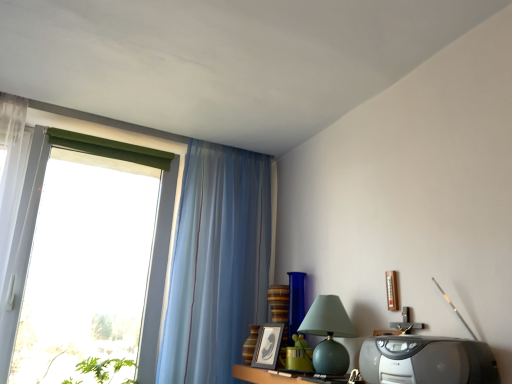
The image size is (512, 384). I want to click on translucent blue curtain at left, so click(x=217, y=263).

Locate an element on the screen. blue glass vase at center, the 2th glass vase when ordered from left to right is located at coordinates (296, 302).

Describe the element at coordinates (279, 308) in the screenshot. I see `striped ceramic vase at center` at that location.

Measure the distance between striped ceramic vase at center and camera.

striped ceramic vase at center is 1.86 meters from camera.

Describe the element at coordinates (39, 199) in the screenshot. I see `transparent glass window at left` at that location.

The height and width of the screenshot is (384, 512). Find the location of `wooden table at lower center`. wooden table at lower center is located at coordinates (262, 376).

Where is `black matte picture frame at center`? Image resolution: width=512 pixels, height=384 pixels. black matte picture frame at center is located at coordinates (268, 346).

Between point (227, 263) and point (302, 301), which one is positioned behind?

The point (227, 263) is more distant.

Could you measure the distance between translucent blue curtain at left and blue glass vase at center, the 2th glass vase when ordered from left to right?

They are 16.41 inches apart.

From the picture: Does translucent blue curtain at left lie in front of blue glass vase at center, acting as the first glass vase starting from the right?

Yes, it is.

Which of these two, translucent blue curtain at left or blue glass vase at center, acting as the first glass vase starting from the right, stands taller?

Result: translucent blue curtain at left.

From the transparent glass window at left, count 2nd glass vase to the right and point to it. Please provide its 2D coordinates.

[(296, 302)]

Could blue glass vase at center, the 2th glass vase when ordered from left to right, be considered to be inside transparent glass window at left?

No, transparent glass window at left does not contain blue glass vase at center, the 2th glass vase when ordered from left to right.

In the scene shown: Based on their positions, is transparent glass window at left located to the left or right of blue glass vase at center, the 2th glass vase when ordered from left to right?

In the image, transparent glass window at left appears on the left side of blue glass vase at center, the 2th glass vase when ordered from left to right.

Is transparent glass window at left positioned with its back to blue glass vase at center, acting as the first glass vase starting from the right?

No, transparent glass window at left's orientation is not away from blue glass vase at center, acting as the first glass vase starting from the right.

How many degrees apart are the facing directions of striped ceramic vase at center and black matte picture frame at center?

They differ by 27 degrees in their facing directions.

Is striped ceramic vase at center looking in the opposite direction of black matte picture frame at center?

No.

Considering the positions of points (281, 346) and (254, 358), is point (281, 346) closer to camera compared to point (254, 358)?

No.

Who is taller, striped ceramic vase at center or black matte picture frame at center?

Standing taller between the two is striped ceramic vase at center.

From a real-world perspective, which is physically above, black matte picture frame at center or blue glass vase at center, the 2th glass vase when ordered from left to right?

In real-world perspective, blue glass vase at center, the 2th glass vase when ordered from left to right, is above.

Is black matte picture frame at center at the left side of blue glass vase at center, acting as the first glass vase starting from the right?

Yes, black matte picture frame at center is to the left of blue glass vase at center, acting as the first glass vase starting from the right.

Is black matte picture frame at center bigger than blue glass vase at center, the 2th glass vase when ordered from left to right?

Actually, black matte picture frame at center might be smaller than blue glass vase at center, the 2th glass vase when ordered from left to right.

Which of these two, translucent blue curtain at left or striped ceramic vase at center, is smaller?

striped ceramic vase at center is smaller.

In terms of height, does translucent blue curtain at left look taller or shorter compared to striped ceramic vase at center?

translucent blue curtain at left is taller than striped ceramic vase at center.

Is translucent blue curtain at left placed right next to striped ceramic vase at center?

They are not placed beside each other.

Is transparent glass window at left not near striped glass vase at center, acting as the 2th glass vase starting from the right?

Actually, transparent glass window at left and striped glass vase at center, acting as the 2th glass vase starting from the right, are a little close together.

From a real-world perspective, is transparent glass window at left on top of striped glass vase at center, the first glass vase from the left?

Correct, in the physical world, transparent glass window at left is higher than striped glass vase at center, the first glass vase from the left.

Is transparent glass window at left aimed at striped glass vase at center, the first glass vase from the left?

Yes.

Would you say transparent glass window at left contains striped glass vase at center, the first glass vase from the left?

No, transparent glass window at left does not contain striped glass vase at center, the first glass vase from the left.

From a real-world perspective, between striped ceramic vase at center and matte green glass table lamp at center-right, who is vertically lower?

matte green glass table lamp at center-right.

Is striped ceramic vase at center taller or shorter than matte green glass table lamp at center-right?

In the image, striped ceramic vase at center appears to be taller than matte green glass table lamp at center-right.

Considering the relative sizes of striped ceramic vase at center and matte green glass table lamp at center-right in the image provided, is striped ceramic vase at center thinner than matte green glass table lamp at center-right?

Yes.

From the image's perspective, who appears lower, striped ceramic vase at center or matte green glass table lamp at center-right?

striped ceramic vase at center is shown below in the image.

Locate an element on the screen. curtain that is above the blue glass vase at center, the 2th glass vase when ordered from left to right (from a real-world perspective) is located at coordinates (217, 263).

The image size is (512, 384). I want to click on window lying on the left of blue glass vase at center, the 2th glass vase when ordered from left to right, so click(39, 199).

Based on their spatial positions, is striped glass vase at center, the first glass vase from the left, or matte green glass table lamp at center-right closer to striped ceramic vase at center?

Based on the image, striped glass vase at center, the first glass vase from the left, appears to be nearer to striped ceramic vase at center.

From the image, which object appears to be farther from blue glass vase at center, acting as the first glass vase starting from the right, transparent glass window at left or black matte picture frame at center?

transparent glass window at left is further to blue glass vase at center, acting as the first glass vase starting from the right.

Which object lies nearer to the anchor point striped glass vase at center, the first glass vase from the left, transparent glass window at left or translucent blue curtain at left?

Based on the image, translucent blue curtain at left appears to be nearer to striped glass vase at center, the first glass vase from the left.

Estimate the real-world distances between objects in this image. Which object is closer to blue glass vase at center, acting as the first glass vase starting from the right, wooden table at lower center or striped glass vase at center, the first glass vase from the left?

The object closer to blue glass vase at center, acting as the first glass vase starting from the right, is striped glass vase at center, the first glass vase from the left.

From the image, which object appears to be farther from transparent glass window at left, black matte picture frame at center or blue glass vase at center, the 2th glass vase when ordered from left to right?

Among the two, blue glass vase at center, the 2th glass vase when ordered from left to right, is located further to transparent glass window at left.

Considering their positions, is matte green glass table lamp at center-right positioned further to translucent blue curtain at left than transparent glass window at left?

matte green glass table lamp at center-right is positioned further to the anchor translucent blue curtain at left.

Looking at this image, looking at the image, which one is located closer to striped glass vase at center, the first glass vase from the left, translucent blue curtain at left or blue glass vase at center, the 2th glass vase when ordered from left to right?

Among the two, blue glass vase at center, the 2th glass vase when ordered from left to right, is located nearer to striped glass vase at center, the first glass vase from the left.

Consider the image. Looking at the image, which one is located further to striped ceramic vase at center, matte green glass table lamp at center-right or translucent blue curtain at left?

matte green glass table lamp at center-right lies further to striped ceramic vase at center than the other object.

Identify the location of picture frame between wooden table at lower center and striped glass vase at center, the first glass vase from the left, in the front-back direction. The width and height of the screenshot is (512, 384). (268, 346).

Identify the location of vase located between striped glass vase at center, acting as the 2th glass vase starting from the right, and blue glass vase at center, acting as the first glass vase starting from the right, in the left-right direction. (279, 308).

Identify the location of curtain between wooden table at lower center and striped ceramic vase at center in the front-back direction. (217, 263).

Image resolution: width=512 pixels, height=384 pixels. In order to click on table lamp between wooden table at lower center and blue glass vase at center, the 2th glass vase when ordered from left to right, in the front-back direction in this screenshot , I will do `click(328, 334)`.